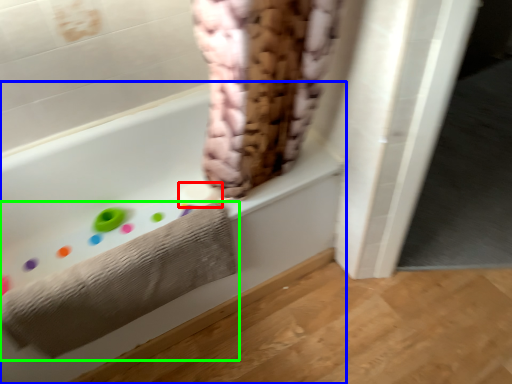
Question: Which object is the farthest from toilet paper (highlighted by a red box)? Choose among these: bathtub (highlighted by a blue box) or towel (highlighted by a green box).

Choices:
 (A) bathtub
 (B) towel

Answer: (B)